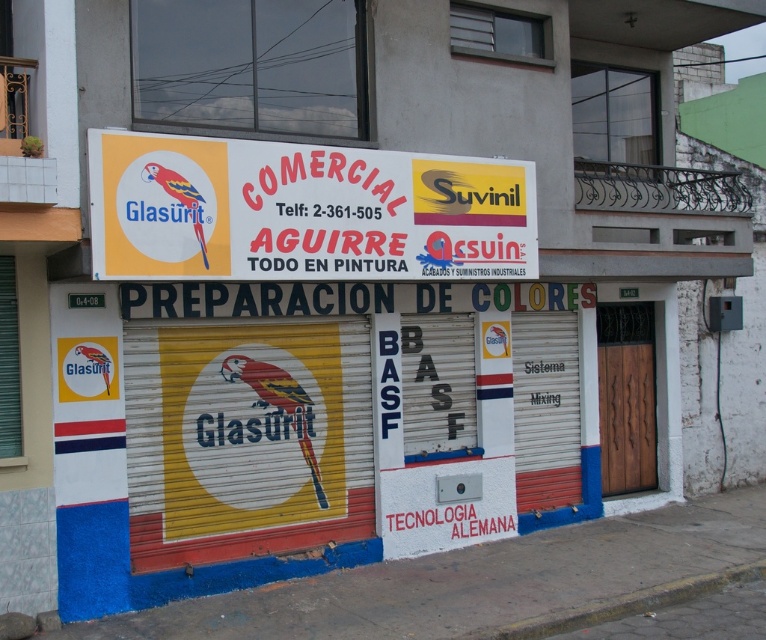
You are standing in front of the Comercial Aguirre store. You need to find the exact location of the point with coordinates point (627, 396). Where is this point located?

The point (627, 396) is located on the wooden door at right.